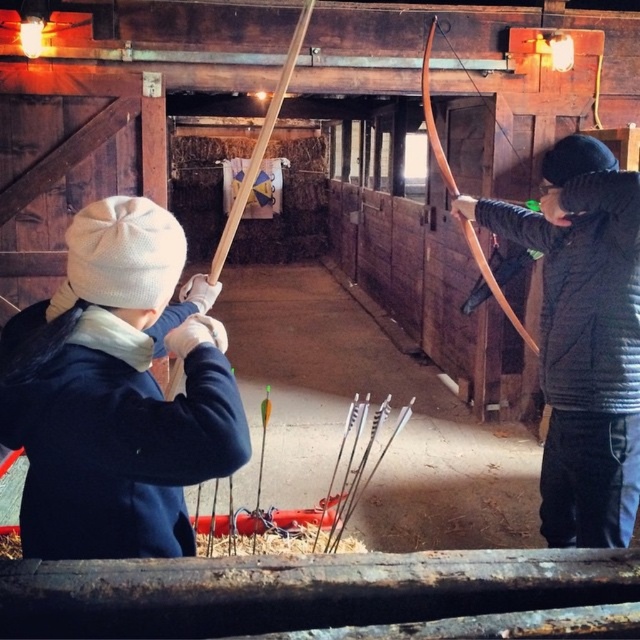
Which is below, matte black jacket at right or wooden bow at center?

matte black jacket at right

Who is more forward, (x=580, y=237) or (x=506, y=301)?

Point (x=580, y=237) is in front.

Is point (566, 390) positioned behind point (429, 26)?

No, it is not.

In order to click on matte black jacket at right in this screenshot , I will do `click(582, 337)`.

Looking at this image, is matte blue jacket at left to the right of matte black jacket at right from the viewer's perspective?

In fact, matte blue jacket at left is to the left of matte black jacket at right.

The height and width of the screenshot is (640, 640). What are the coordinates of `matte blue jacket at left` in the screenshot? It's located at (115, 394).

Consider the image. Does matte blue jacket at left lie in front of wooden bow at center?

Yes, matte blue jacket at left is closer to the viewer.

Is matte blue jacket at left positioned behind wooden bow at center?

No, matte blue jacket at left is in front of wooden bow at center.

The image size is (640, 640). Identify the location of matte blue jacket at left. (115, 394).